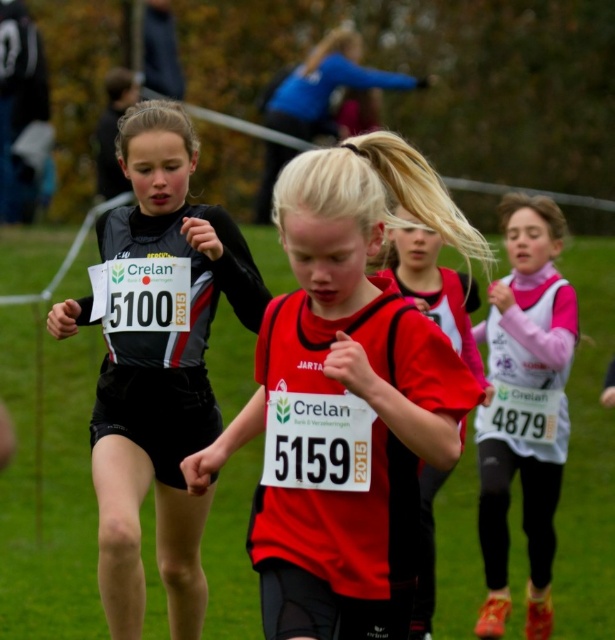
You are a photographer at the cross country event and you want to take a photo of the matte red shirt at center and the black matte jersey at left. The camera can only focus on objects within a 3 meter width. Given that the total width of both objects combined is 2.8 meters, will both fit in the frame?

The matte red shirt at center is wider than the black matte jersey at left. Since their combined width is 2.8 meters, which is under the 3 meter limit, both will fit in the frame.

You are a photographer at the cross country event. You need to capture a photo of the athlete wearing the red sports jersey with the number 5159. However, there is a matte red shirt at center and a red matte jersey at center in the scene. Which one should you focus on to ensure you capture the correct clothing item?

The correct clothing item to focus on is the red matte jersey at center because the matte red shirt at center is positioned below it, indicating that the jersey is the upper garment with the number 5159.